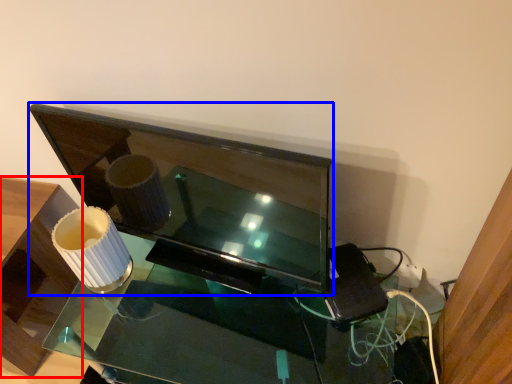
Question: Which object appears farthest to the camera in this image, furniture (highlighted by a red box) or television (highlighted by a blue box)?

Choices:
 (A) furniture
 (B) television

Answer: (A)